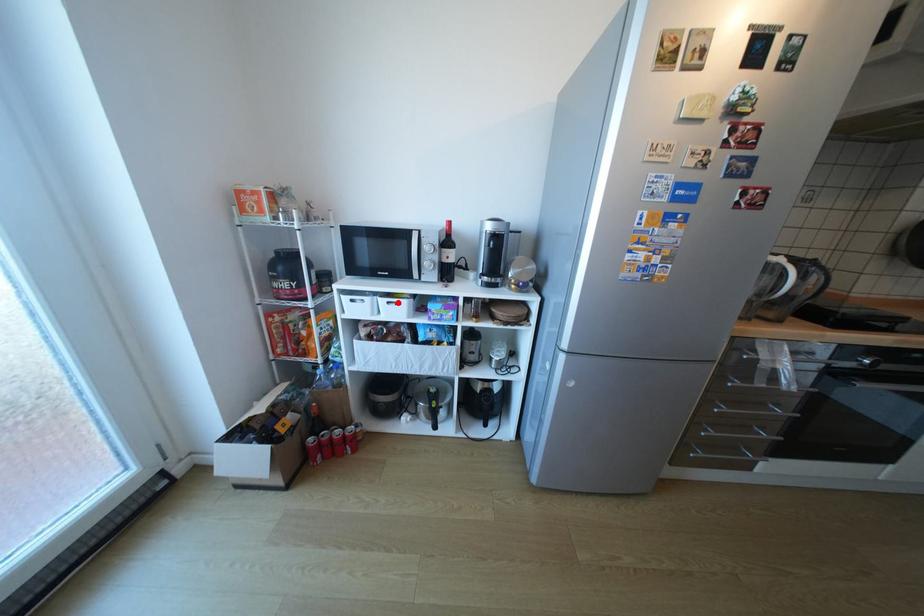
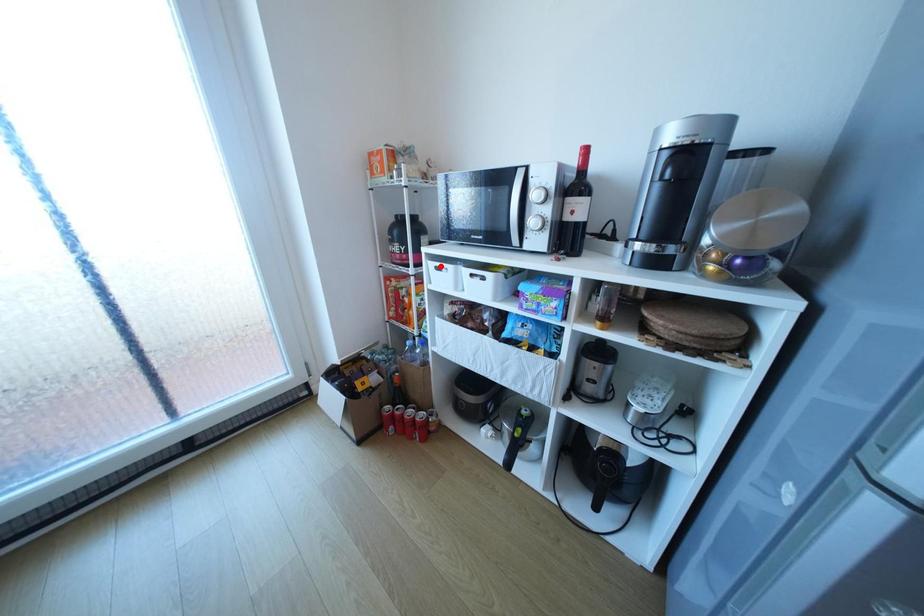
I am providing you with two images of the same scene from different viewpoints. A red point is marked on the first image and another point is marked on the second image. Is the red point in image1 aligned with the point shown in image2?

No